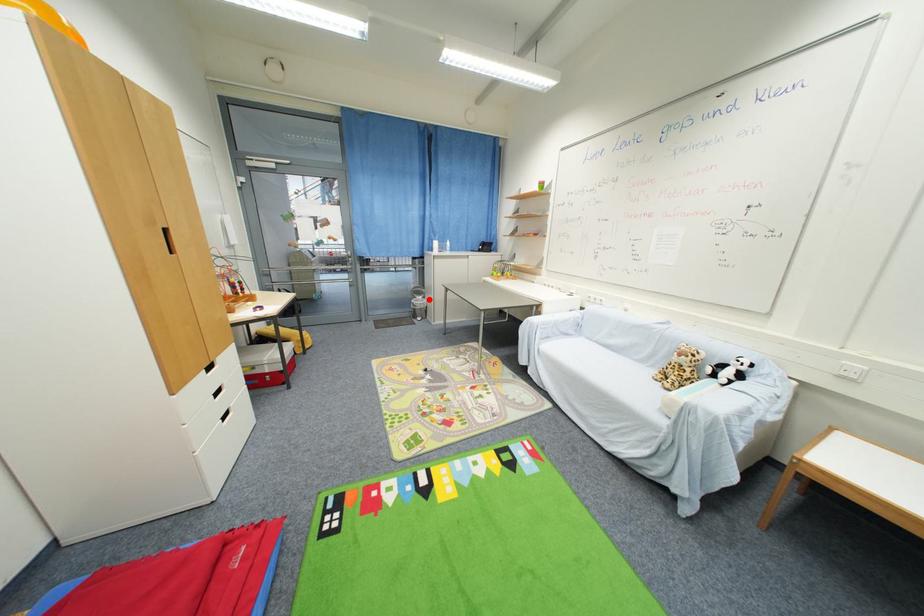
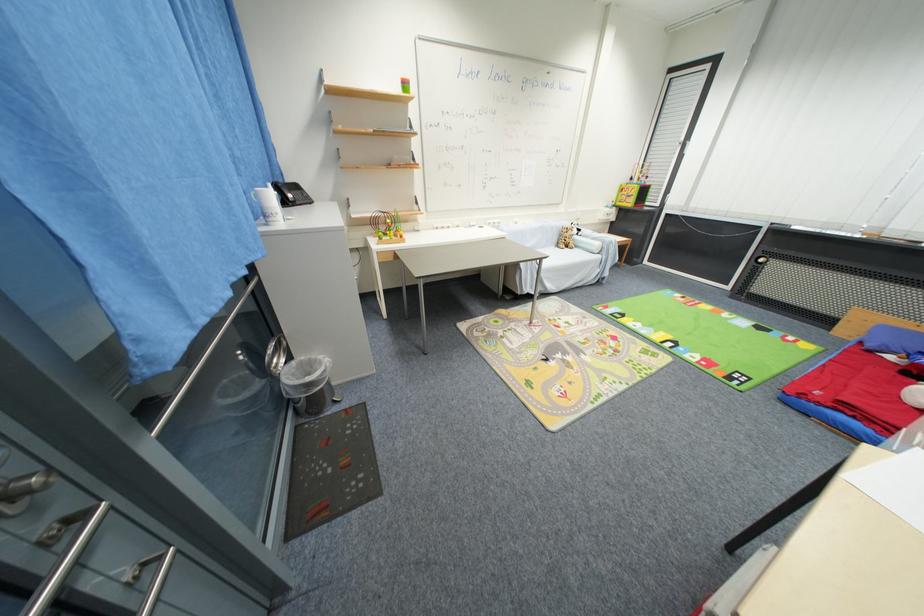
Question: I am providing you with two images of the same scene from different viewpoints. Given a red point in image1, look at the same physical point in image2. Is it:

Choices:
 (A) Closer to the viewpoint
 (B) Farther from the viewpoint

Answer: (A)